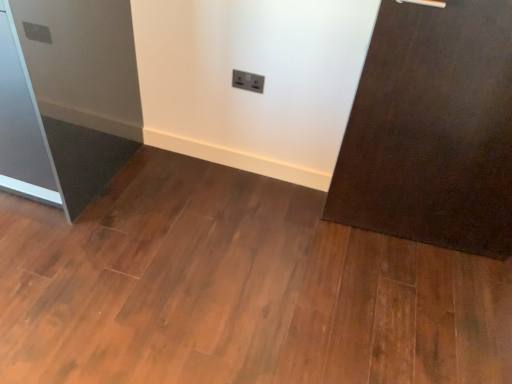
The height and width of the screenshot is (384, 512). Identify the location of satin silver fridge at left. (67, 98).

Describe the element at coordinates (67, 98) in the screenshot. The image size is (512, 384). I see `satin silver fridge at left` at that location.

Describe the element at coordinates (248, 81) in the screenshot. I see `white plastic electric outlet at center` at that location.

The image size is (512, 384). I want to click on white plastic electric outlet at center, so click(248, 81).

Image resolution: width=512 pixels, height=384 pixels. I want to click on satin silver fridge at left, so point(67,98).

Which is more to the right, satin silver fridge at left or white plastic electric outlet at center?

white plastic electric outlet at center is more to the right.

Considering their positions, is satin silver fridge at left located in front of or behind white plastic electric outlet at center?

Clearly, satin silver fridge at left is in front of white plastic electric outlet at center.

Which is more distant, (72, 152) or (239, 75)?

Positioned behind is point (239, 75).

From the image's perspective, is satin silver fridge at left under white plastic electric outlet at center?

Yes, from the image's perspective, satin silver fridge at left is beneath white plastic electric outlet at center.

From a real-world perspective, is satin silver fridge at left positioned above or below white plastic electric outlet at center?

→ In terms of real-world spatial position, satin silver fridge at left is below white plastic electric outlet at center.

Looking at their sizes, would you say satin silver fridge at left is wider or thinner than white plastic electric outlet at center?

Clearly, satin silver fridge at left has more width compared to white plastic electric outlet at center.

In the scene shown: Does satin silver fridge at left have a greater height compared to white plastic electric outlet at center?

Yes, satin silver fridge at left is taller than white plastic electric outlet at center.

Who is bigger, satin silver fridge at left or white plastic electric outlet at center?

Bigger between the two is satin silver fridge at left.

Do you think satin silver fridge at left is within white plastic electric outlet at center, or outside of it?

satin silver fridge at left cannot be found inside white plastic electric outlet at center.

Does satin silver fridge at left touch white plastic electric outlet at center?

No, satin silver fridge at left is not next to white plastic electric outlet at center.

Is satin silver fridge at left positioned with its back to white plastic electric outlet at center?

No, satin silver fridge at left is not facing the opposite direction of white plastic electric outlet at center.

What's the angular difference between satin silver fridge at left and white plastic electric outlet at center's facing directions?

satin silver fridge at left and white plastic electric outlet at center are facing 0.887 degrees away from each other.

In order to click on electric outlet behind the satin silver fridge at left in this screenshot , I will do `click(248, 81)`.

Considering the positions of objects white plastic electric outlet at center and satin silver fridge at left in the image provided, who is more to the left, white plastic electric outlet at center or satin silver fridge at left?

Positioned to the left is satin silver fridge at left.

Does white plastic electric outlet at center lie behind satin silver fridge at left?

Yes, white plastic electric outlet at center is behind satin silver fridge at left.

Is point (251, 90) closer or farther from the camera than point (81, 166)?

Point (251, 90).

From the image's perspective, is white plastic electric outlet at center on top of satin silver fridge at left?

Yes, from the image's perspective, white plastic electric outlet at center is over satin silver fridge at left.

From a real-world perspective, between white plastic electric outlet at center and satin silver fridge at left, who is vertically lower?

In real-world perspective, satin silver fridge at left is lower.

In terms of width, does white plastic electric outlet at center look wider or thinner when compared to satin silver fridge at left?

Considering their sizes, white plastic electric outlet at center looks slimmer than satin silver fridge at left.

Between white plastic electric outlet at center and satin silver fridge at left, which one has less height?

With less height is white plastic electric outlet at center.

Who is bigger, white plastic electric outlet at center or satin silver fridge at left?

With larger size is satin silver fridge at left.

Is white plastic electric outlet at center completely or partially outside of satin silver fridge at left?

white plastic electric outlet at center lies outside satin silver fridge at left's area.

Does white plastic electric outlet at center touch satin silver fridge at left?

No, white plastic electric outlet at center is not touching satin silver fridge at left.

Is white plastic electric outlet at center looking in the opposite direction of satin silver fridge at left?

No.

In order to click on electric outlet positioned vertically above the satin silver fridge at left (from a real-world perspective) in this screenshot , I will do `click(248, 81)`.

I want to click on fridge lying in front of the white plastic electric outlet at center, so click(67, 98).

You are a GUI agent. You are given a task and a screenshot of the screen. Output one action in this format:
    pyautogui.click(x=<x>, y=<y>)
    Task: Click on the electric outlet above the satin silver fridge at left (from a real-world perspective)
    
    Given the screenshot: What is the action you would take?
    pyautogui.click(x=248, y=81)